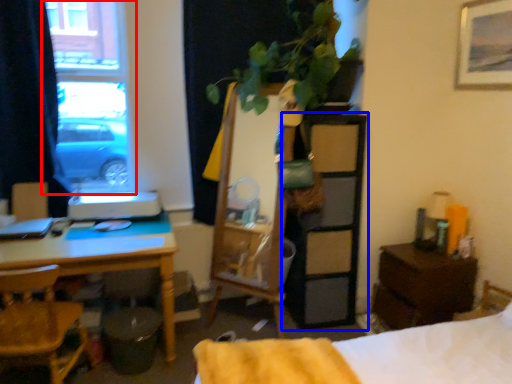
Question: Which object appears farthest to the camera in this image, window (highlighted by a red box) or dresser (highlighted by a blue box)?

Choices:
 (A) window
 (B) dresser

Answer: (B)